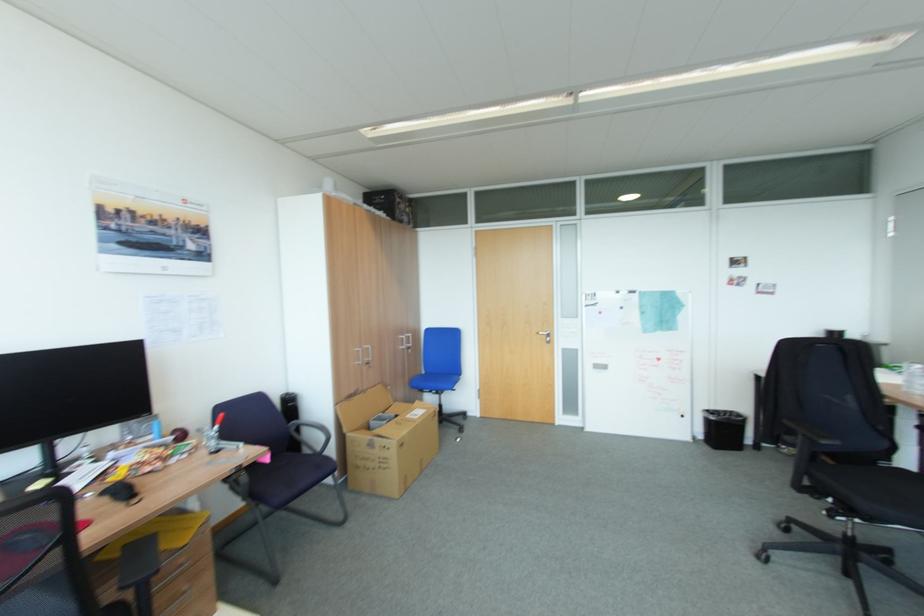
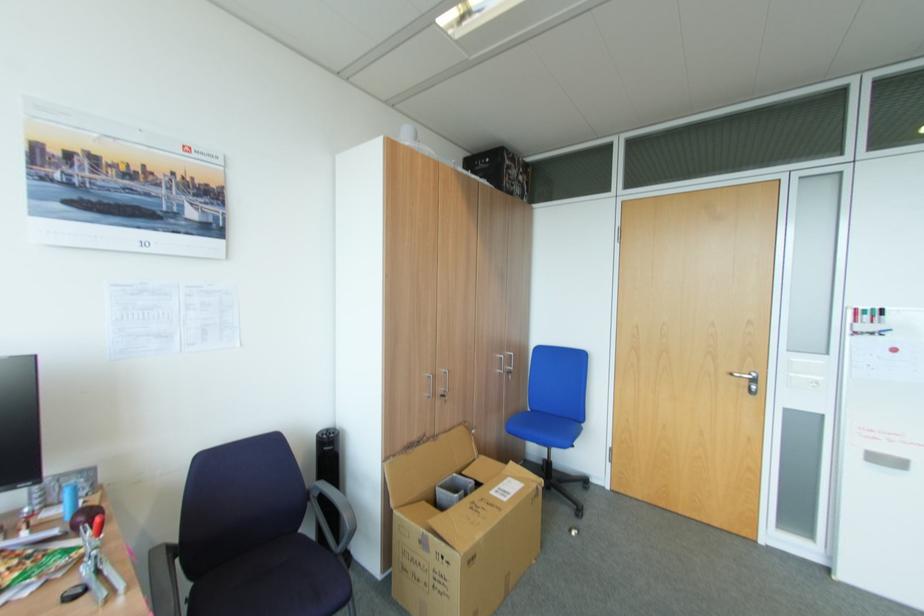
In the second image, find the point that corresponds to (x=551, y=336) in the first image.

(751, 381)